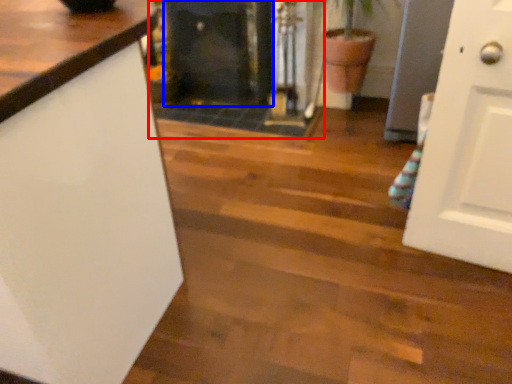
Question: Which point is closer to the camera, fireplace (highlighted by a red box) or fireplace (highlighted by a blue box)?

Choices:
 (A) fireplace
 (B) fireplace

Answer: (A)